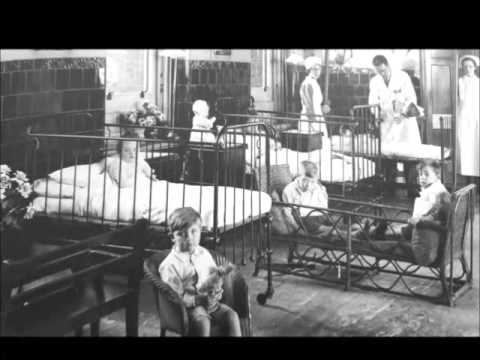
Identify the location of door. (437, 76), (438, 98).